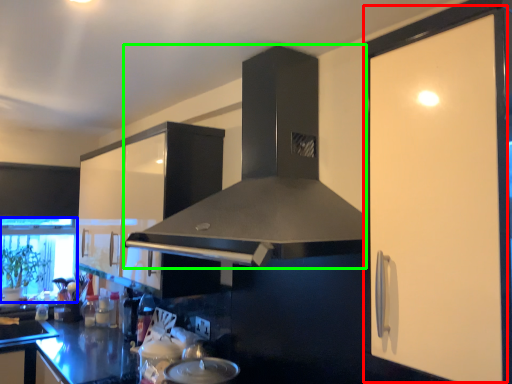
Question: Based on their relative distances, which object is farther from screen door (highlighted by a red box)? Choose from window screen (highlighted by a blue box) and home appliance (highlighted by a green box).

Choices:
 (A) window screen
 (B) home appliance

Answer: (A)